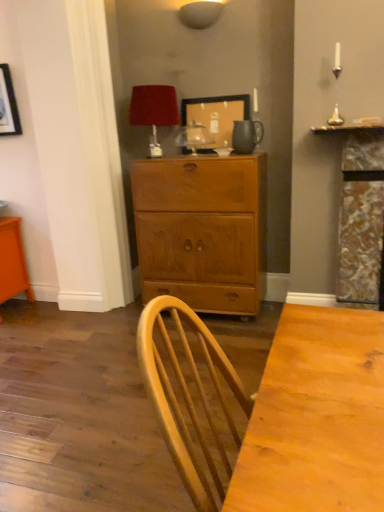
Question: Which direction should I rotate to look at matte white lampshade at upper center, which appears as the second lamp when ordered from the bottom?

Choices:
 (A) right
 (B) left

Answer: (A)

Question: Considering the relative positions of matte white lampshade at upper center, the 1th lamp when ordered from right to left, and matte brown pitcher at upper center in the image provided, is matte white lampshade at upper center, the 1th lamp when ordered from right to left, to the right of matte brown pitcher at upper center from the viewer's perspective?

Choices:
 (A) yes
 (B) no

Answer: (B)

Question: Can you confirm if matte white lampshade at upper center, which is the 2th lamp from left to right, is thinner than matte brown pitcher at upper center?

Choices:
 (A) yes
 (B) no

Answer: (B)

Question: From the image's perspective, is matte white lampshade at upper center, the 1th lamp when ordered from right to left, located above matte brown pitcher at upper center?

Choices:
 (A) no
 (B) yes

Answer: (B)

Question: Is matte white lampshade at upper center, the 1th lamp when ordered from right to left, placed right next to matte brown pitcher at upper center?

Choices:
 (A) yes
 (B) no

Answer: (B)

Question: From the image's perspective, is matte white lampshade at upper center, the first lamp viewed from the top, below matte brown pitcher at upper center?

Choices:
 (A) yes
 (B) no

Answer: (B)

Question: Are matte white lampshade at upper center, the 1th lamp when ordered from right to left, and matte brown pitcher at upper center far apart?

Choices:
 (A) no
 (B) yes

Answer: (A)

Question: Considering the relative sizes of velvet red lampshade at upper center, the 1th lamp in the bottom-to-top sequence, and wooden cabinet at center in the image provided, is velvet red lampshade at upper center, the 1th lamp in the bottom-to-top sequence, bigger than wooden cabinet at center?

Choices:
 (A) no
 (B) yes

Answer: (A)

Question: Can you confirm if velvet red lampshade at upper center, which ranks as the second lamp in right-to-left order, is smaller than wooden cabinet at center?

Choices:
 (A) yes
 (B) no

Answer: (A)

Question: Is wooden cabinet at center inside velvet red lampshade at upper center, the 1th lamp in the bottom-to-top sequence?

Choices:
 (A) no
 (B) yes

Answer: (A)

Question: Does velvet red lampshade at upper center, the second lamp in the top-to-bottom sequence, lie in front of wooden cabinet at center?

Choices:
 (A) yes
 (B) no

Answer: (B)

Question: From a real-world perspective, is velvet red lampshade at upper center, the 1th lamp in the bottom-to-top sequence, below wooden cabinet at center?

Choices:
 (A) yes
 (B) no

Answer: (B)

Question: Is velvet red lampshade at upper center, which ranks as the second lamp in right-to-left order, positioned with its back to wooden cabinet at center?

Choices:
 (A) yes
 (B) no

Answer: (B)

Question: Does velvet red lampshade at upper center, the 1th lamp in the bottom-to-top sequence, have a greater width compared to wooden picture frame at upper center?

Choices:
 (A) no
 (B) yes

Answer: (B)